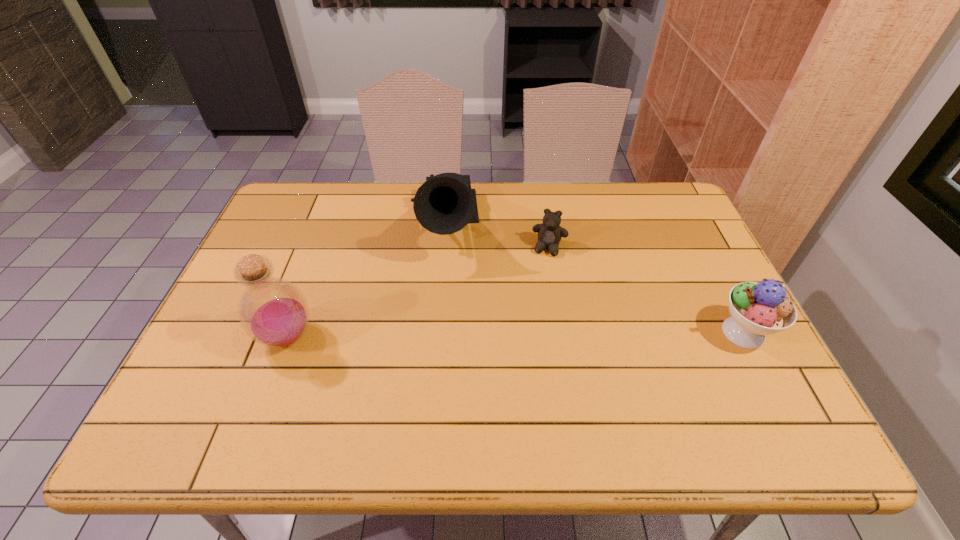
Where is `blank space at the far left corner`? The image size is (960, 540). blank space at the far left corner is located at coordinates click(x=300, y=182).

What are the coordinates of `free space at the far right corner of the desktop` in the screenshot? It's located at (670, 198).

This screenshot has width=960, height=540. I want to click on free spot between the second shortest object and the phonograph_record, so click(x=593, y=280).

In order to click on vacant space in between the third tallest object and the phonograph_record in this screenshot , I will do `click(593, 280)`.

Image resolution: width=960 pixels, height=540 pixels. What are the coordinates of `unoccupied area between the rightmost object and the bottle` in the screenshot? It's located at (516, 335).

Identify the location of free area in between the shortest object and the phonograph_record. This screenshot has height=540, width=960. (496, 237).

Locate an element on the screen. vacant area that lies between the third tallest object and the leftmost object is located at coordinates (516, 335).

This screenshot has width=960, height=540. I want to click on vacant space in between the phonograph_record and the third tallest object, so click(x=593, y=280).

Locate an element on the screen. free spot between the leftmost object and the rightmost object is located at coordinates (516, 335).

At what (x,y) coordinates should I click in order to perform the action: click on empty location between the third tallest object and the phonograph_record. Please return your answer as a coordinate pair (x, y). Looking at the image, I should click on (593, 280).